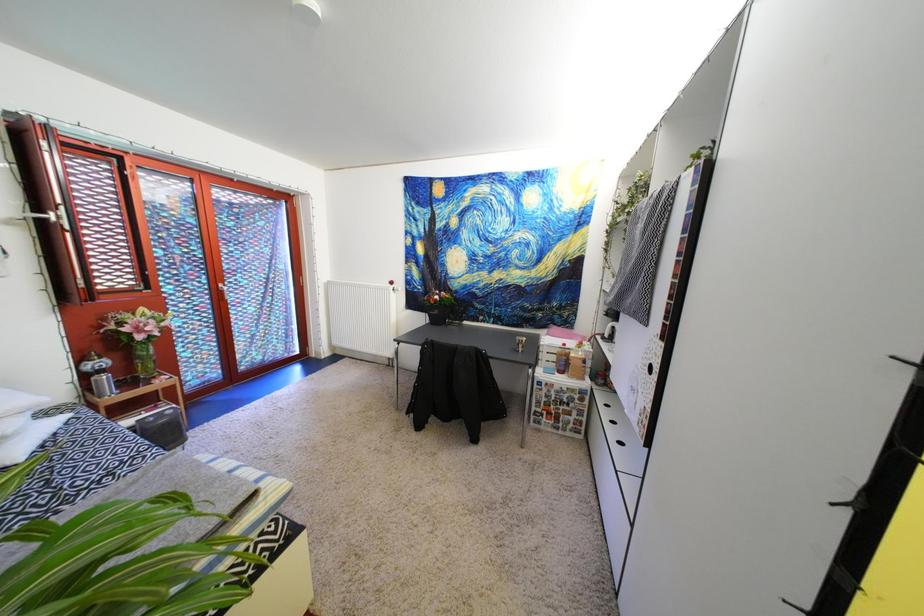
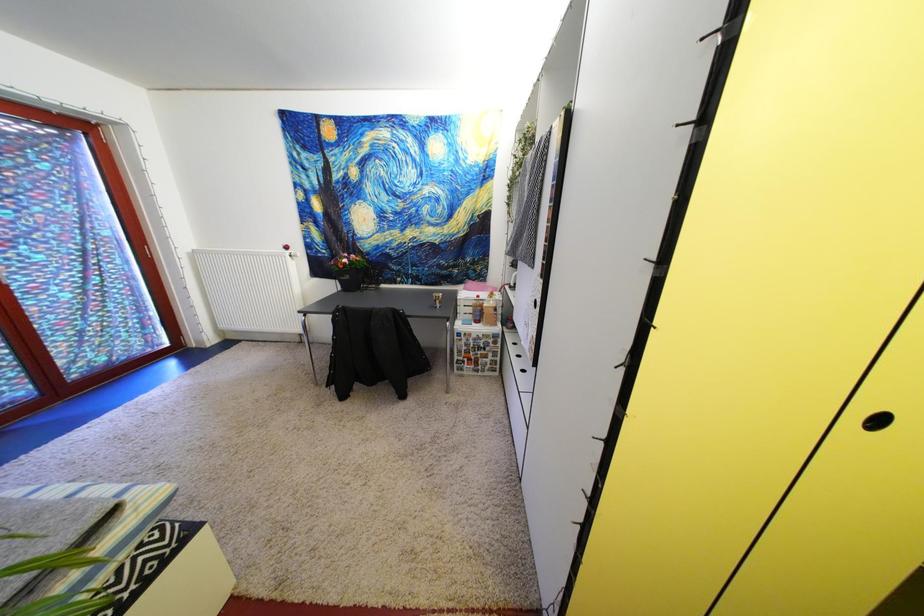
Question: Based on the continuous images, in which direction is the camera rotating? Reply with the corresponding letter.

Choices:
 (A) Left
 (B) Right
 (C) Up
 (D) Down

Answer: (B)